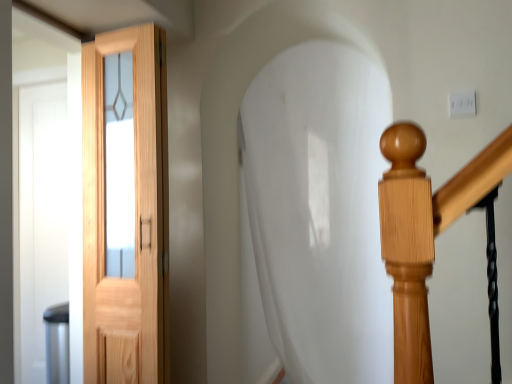
Question: Should I look upward or downward to see natural wood door at left?

Choices:
 (A) up
 (B) down

Answer: (B)